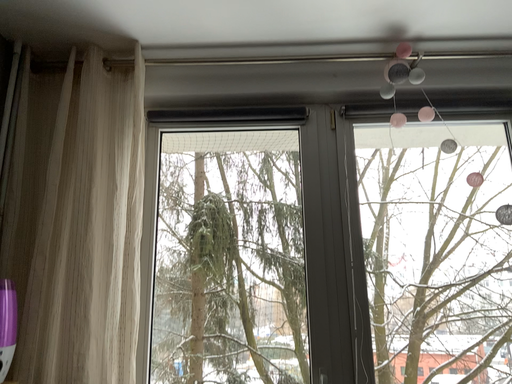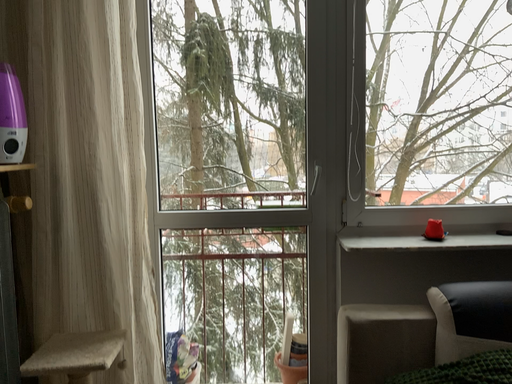
Question: Which way did the camera rotate in the video?

Choices:
 (A) rotated downward
 (B) rotated upward

Answer: (A)